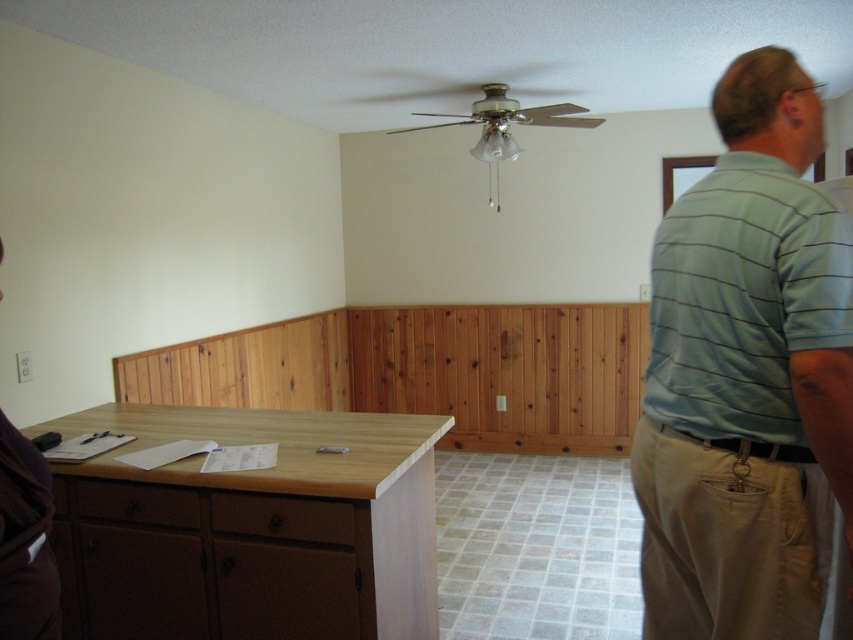
Who is shorter, light blue striped shirt at upper right or white matte outlet at left?

With less height is white matte outlet at left.

Does light blue striped shirt at upper right have a greater width compared to white matte outlet at left?

Correct, the width of light blue striped shirt at upper right exceeds that of white matte outlet at left.

What do you see at coordinates (746, 372) in the screenshot? This screenshot has width=853, height=640. I see `light blue striped shirt at upper right` at bounding box center [746, 372].

Identify the location of light blue striped shirt at upper right. The image size is (853, 640). (746, 372).